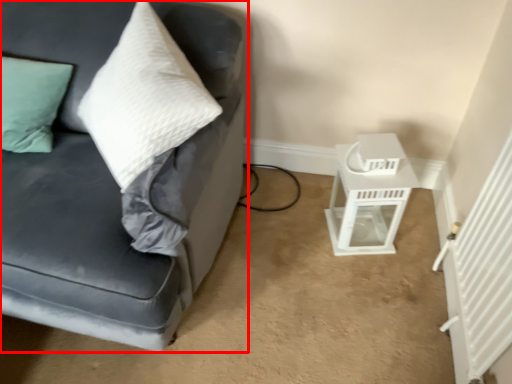
Question: From the image's perspective, considering the relative positions of studio couch (annotated by the red box) and table in the image provided, where is studio couch (annotated by the red box) located with respect to the staircase?

Choices:
 (A) above
 (B) below

Answer: (A)